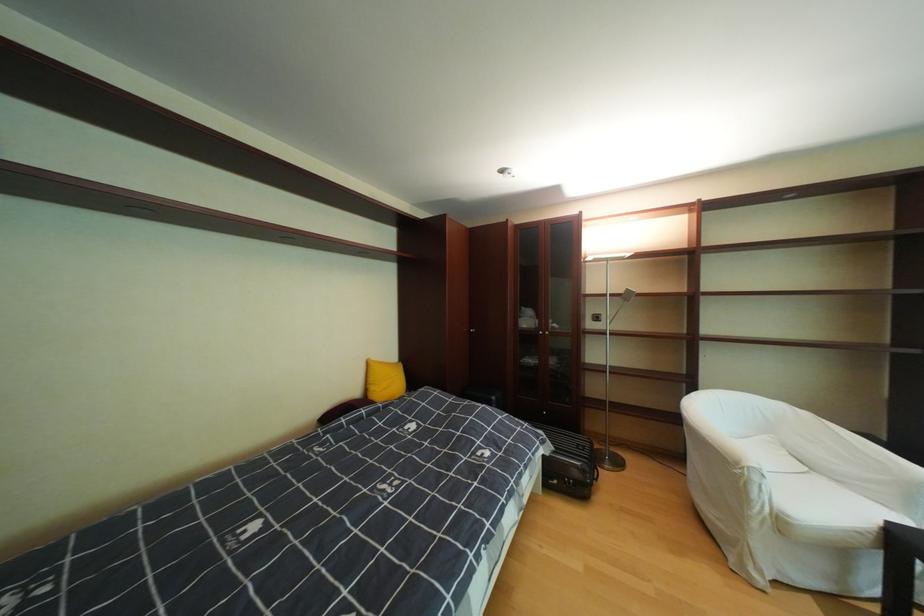
Find where to sit the white sofa sitting surface. Please return your answer as a coordinate pair (x, y).

(796, 493)